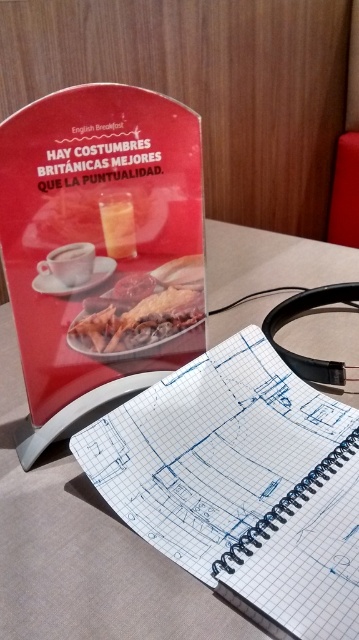
You are a customer at the cafe and want to write a note on the white grid paper at center while listening to music through the black rubber headphones at center. Can you place both items on the table without overlapping them?

The white grid paper at center is larger in size than the black rubber headphones at center, so yes, you can place both items on the table without overlapping them by positioning the headphones on a corner of the paper or placing them next to it.

You are a customer at a restaurant and want to place your black rubber headphones at center on the table without covering the golden crispy chicken at center. Can you do this based on their sizes?

The golden crispy chicken at center is thinner than the black rubber headphones at center, so placing the black rubber headphones at center on the table might cover the chicken if positioned directly over it. However, since the chicken is thinner, there might be enough space around it to place the headphones without covering them completely.